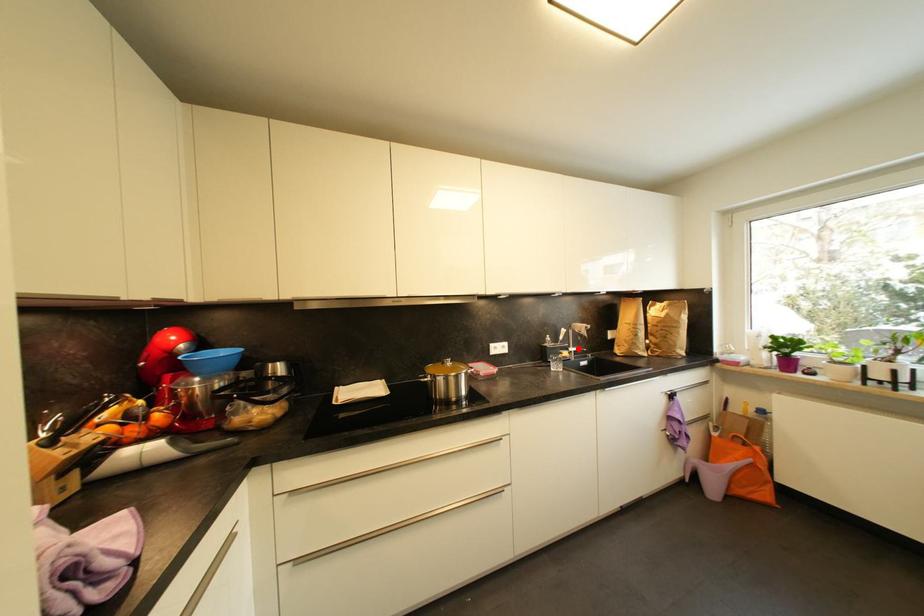
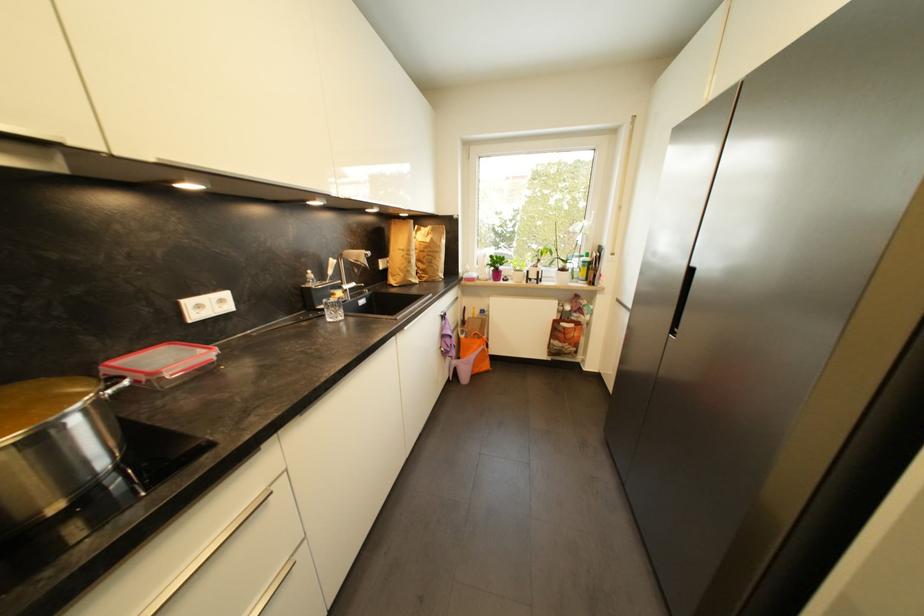
The point at the highlighted location is marked in the first image. Where is the corresponding point in the second image?

(353, 285)